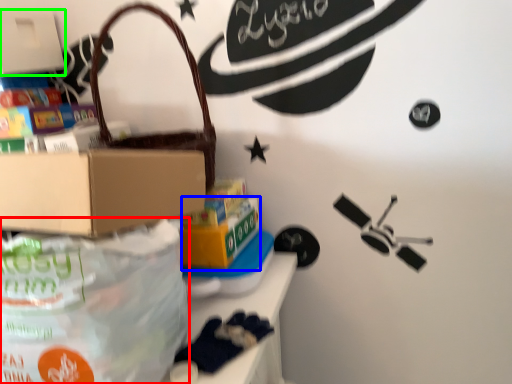
Question: Which object is the farthest from diaper bag (highlighted by a red box)? Choose among these: box (highlighted by a blue box) or box (highlighted by a green box).

Choices:
 (A) box
 (B) box

Answer: (B)